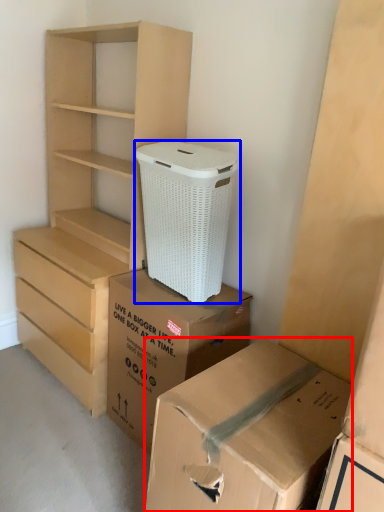
Question: Among these objects, which one is nearest to the camera, box (highlighted by a red box) or shoe box (highlighted by a blue box)?

Choices:
 (A) box
 (B) shoe box

Answer: (A)